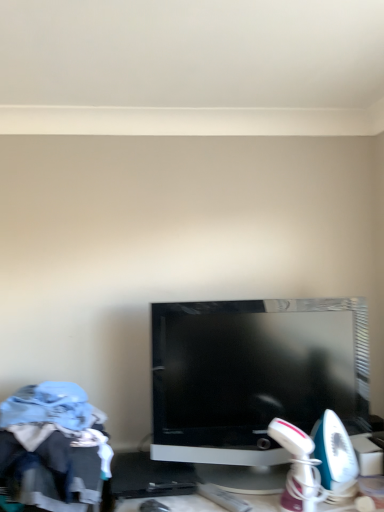
Question: Relative to light blue fabric at lower left, is black glossy television at center in front or behind?

Choices:
 (A) behind
 (B) front

Answer: (A)

Question: Does point (266, 373) appear closer or farther from the camera than point (107, 507)?

Choices:
 (A) closer
 (B) farther

Answer: (B)

Question: Would you say black glossy television at center is to the left or to the right of light blue fabric at lower left in the picture?

Choices:
 (A) right
 (B) left

Answer: (A)

Question: Is light blue fabric at lower left inside the boundaries of black glossy television at center, or outside?

Choices:
 (A) inside
 (B) outside

Answer: (B)

Question: Does point (26, 451) appear closer or farther from the camera than point (168, 457)?

Choices:
 (A) closer
 (B) farther

Answer: (A)

Question: In terms of height, does light blue fabric at lower left look taller or shorter compared to black glossy television at center?

Choices:
 (A) tall
 (B) short

Answer: (B)

Question: Considering the relative positions of light blue fabric at lower left and black glossy television at center in the image provided, is light blue fabric at lower left to the left or to the right of black glossy television at center?

Choices:
 (A) right
 (B) left

Answer: (B)